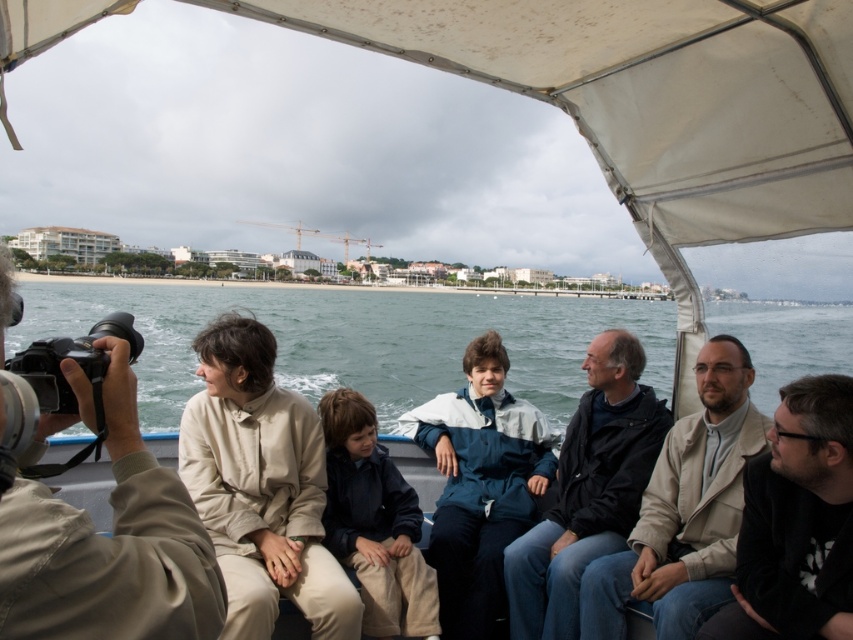
Is beige woolen coat at center bigger than black matte jacket at lower right?

Yes, beige woolen coat at center is bigger than black matte jacket at lower right.

Is point (585, 570) positioned before point (775, 608)?

No, (585, 570) is further to viewer.

Is point (692, 428) farther from camera compared to point (799, 413)?

Yes, it is behind point (799, 413).

Find the location of a particular element. beige woolen coat at center is located at coordinates click(683, 509).

Consider the image. Can you confirm if blue water at lower center is wider than dark blue jacket at center?

Yes.

Which of these two, blue water at lower center or dark blue jacket at center, stands shorter?

With less height is dark blue jacket at center.

Which is behind, point (352, 342) or point (596, 499)?

The point (352, 342) is more distant.

This screenshot has width=853, height=640. Find the location of `blue water at lower center`. blue water at lower center is located at coordinates (357, 339).

Is dark blue jacket at center smaller than black plastic video camera at left?

No, dark blue jacket at center is not smaller than black plastic video camera at left.

Is dark blue jacket at center thinner than black plastic video camera at left?

No, dark blue jacket at center is not thinner than black plastic video camera at left.

Locate an element on the screen. This screenshot has width=853, height=640. dark blue jacket at center is located at coordinates (587, 490).

The width and height of the screenshot is (853, 640). In order to click on dark blue jacket at center in this screenshot , I will do `click(587, 490)`.